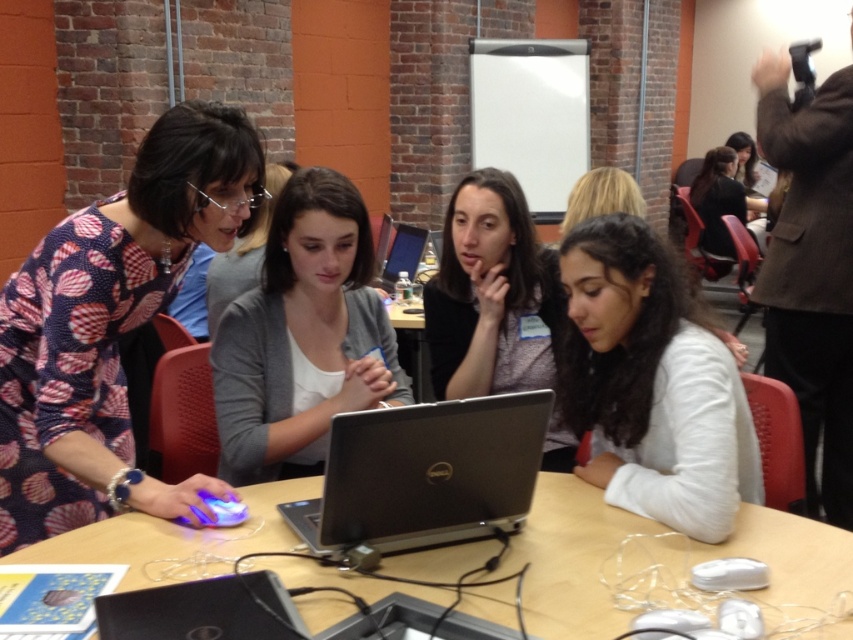
Which is in front, point (109, 449) or point (593, 456)?

Point (109, 449)

Is patterned fabric blouse at left below white matte shirt at center?

Incorrect, patterned fabric blouse at left is not positioned below white matte shirt at center.

Which is in front, point (44, 426) or point (595, 404)?

Positioned in front is point (44, 426).

Find the location of a particular element. Image resolution: width=853 pixels, height=640 pixels. patterned fabric blouse at left is located at coordinates (109, 324).

Does white matte shirt at center come in front of gray cardigan at center?

Yes, white matte shirt at center is closer to the viewer.

Does white matte shirt at center have a smaller size compared to gray cardigan at center?

Actually, white matte shirt at center might be larger than gray cardigan at center.

Which is behind, point (570, 401) or point (294, 289)?

The point (294, 289) is more distant.

Identify the location of white matte shirt at center. This screenshot has height=640, width=853. (653, 385).

Describe the element at coordinates (570, 560) in the screenshot. I see `wooden table at center` at that location.

Does wooden table at center appear over white matte shirt at center?

Incorrect, wooden table at center is not positioned above white matte shirt at center.

Between point (68, 552) and point (732, 358), which one is positioned behind?

Positioned behind is point (732, 358).

Image resolution: width=853 pixels, height=640 pixels. Find the location of `wooden table at center`. wooden table at center is located at coordinates (570, 560).